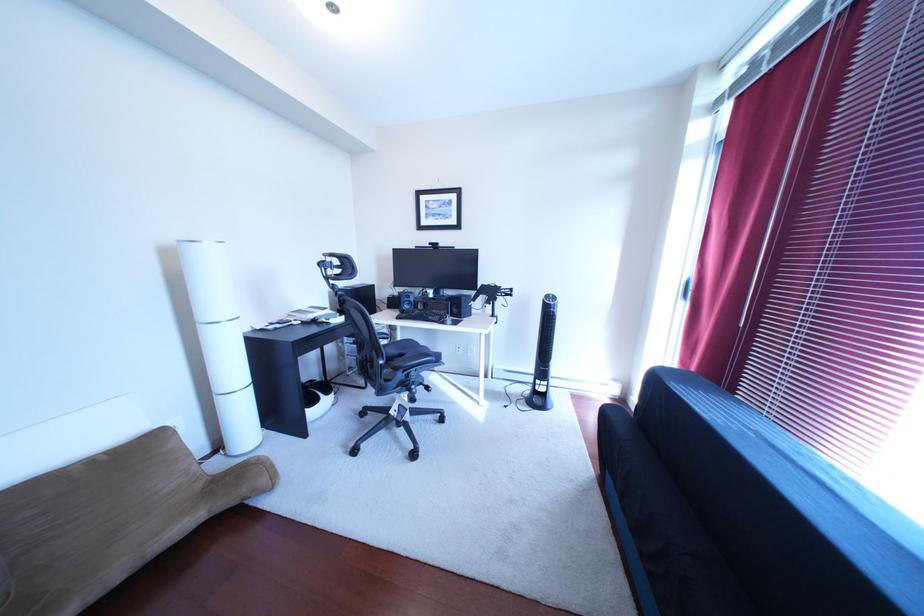
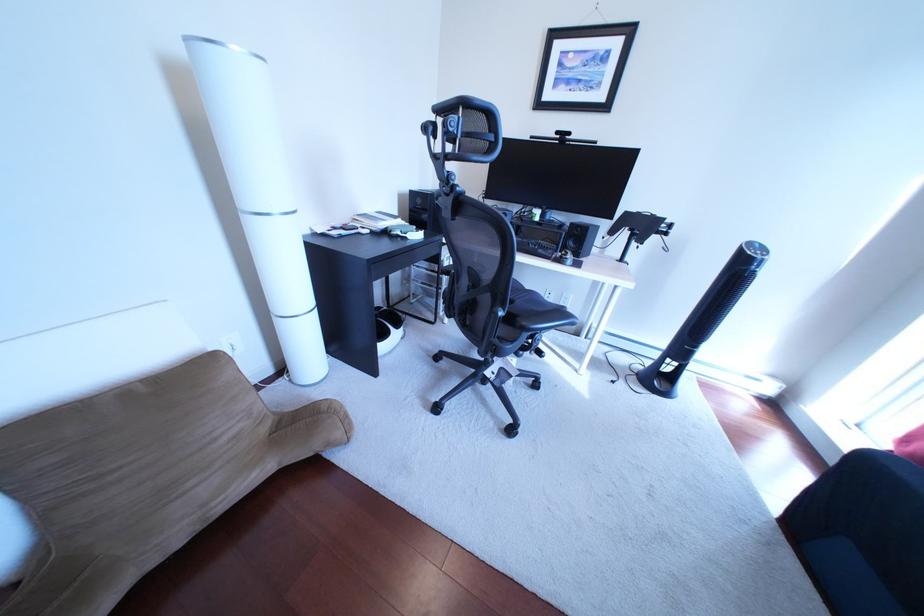
Question: The images are taken continuously from a first-person perspective. In which direction is your viewpoint rotating?

Choices:
 (A) Left
 (B) Right
 (C) Up
 (D) Down

Answer: (D)